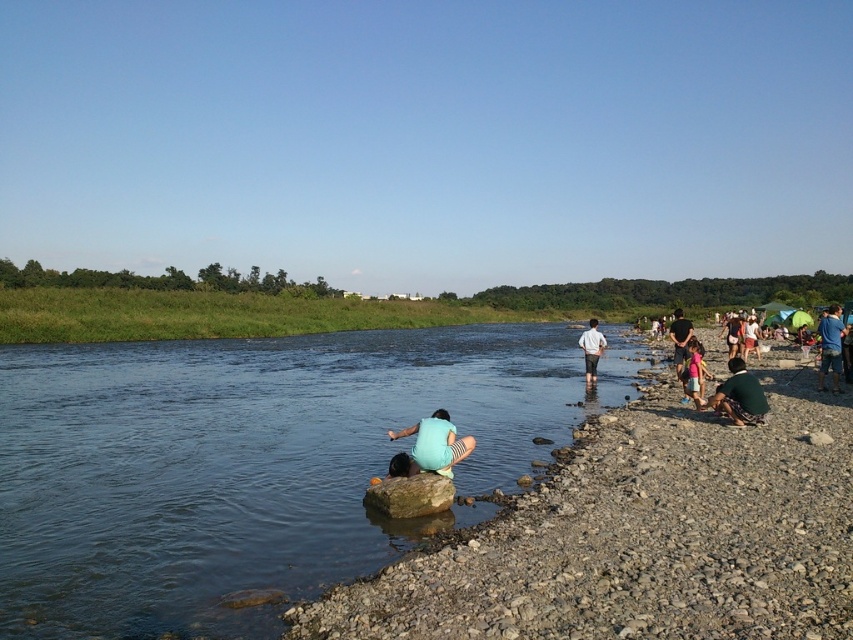
Based on the photo, you are standing at the center of the image and want to move towards the dark green shirt at right. Which direction should you go?

The dark green shirt at right is located at point (679, 340) in the image. Since you are at the center, you should move towards the right and slightly upwards to reach it.

You are standing at the riverside and want to reach a specific point marked as point (x=722, y=390). If your walking distance from your current position to that point is 12.06 meters, would you consider this a short walk or a long walk?

The distance to point (x=722, y=390) is 12.06 meters. Since 12 meters is a moderate distance, it would be considered a short walk.

You are a photographer trying to capture both the white cotton shirt at center and the light blue fabric shirt at right in a single frame. Based on their positions, which shirt would appear closer to the camera in the photo?

The white cotton shirt at center appears closer to the camera because it is positioned under the light blue fabric shirt at right, indicating it is in front in the scene.